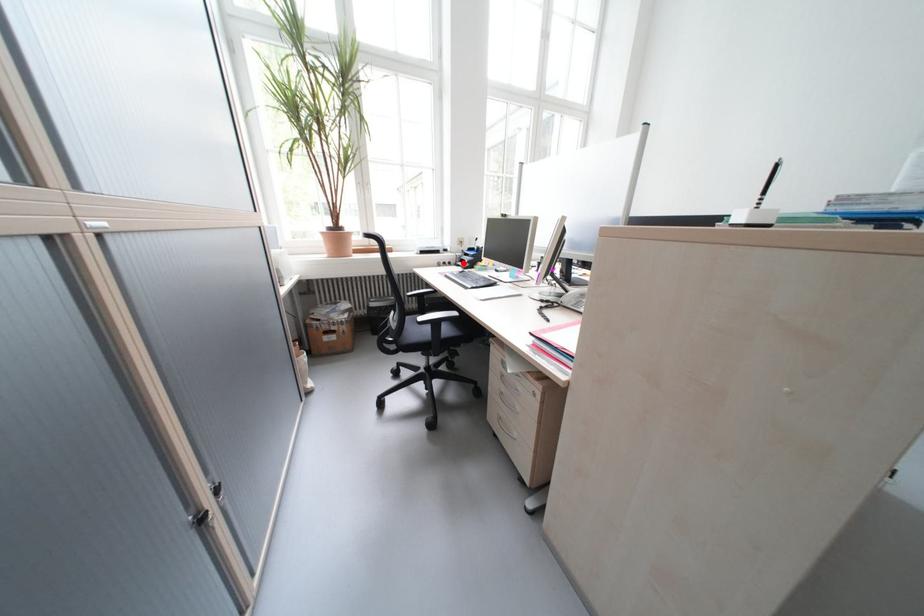
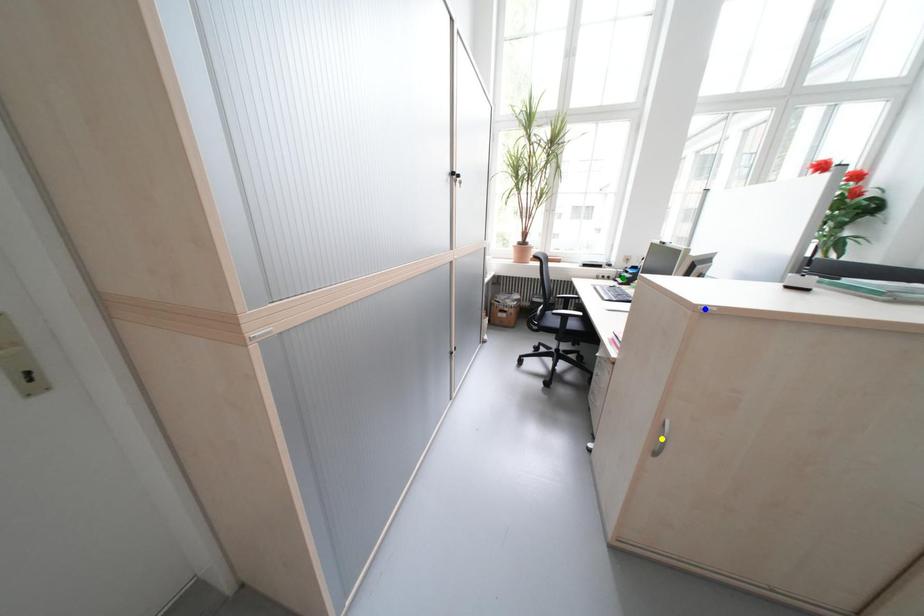
Question: I am providing you with two images of the same scene from different viewpoints. A red point is marked on the first image. You are given multiple points on the second image. In image 2, which mark is for the same physical point as the one in image 1?

Choices:
 (A) blue point
 (B) yellow point
 (C) green point

Answer: (C)